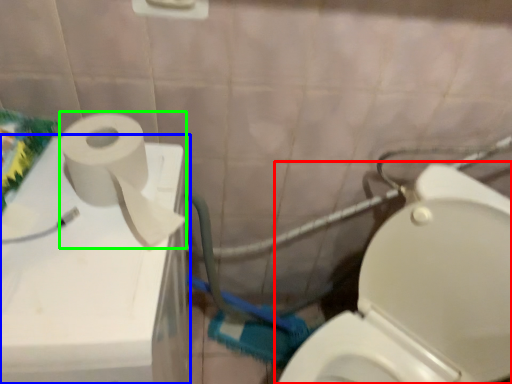
Question: Estimate the real-world distances between objects in this image. Which object is farther from toilet (highlighted by a red box), appliance (highlighted by a blue box) or toiletry paper (highlighted by a green box)?

Choices:
 (A) appliance
 (B) toiletry paper

Answer: (B)